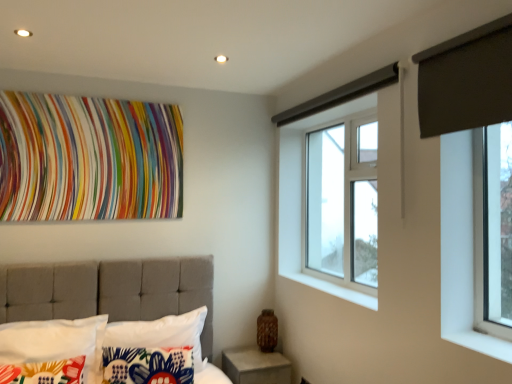
Question: Relative to clear glass window at upper center, is floral fabric pillow at lower left, which ranks as the 2th pillow in left-to-right order, in front or behind?

Choices:
 (A) front
 (B) behind

Answer: (A)

Question: Does point (146, 349) appear closer or farther from the camera than point (342, 198)?

Choices:
 (A) farther
 (B) closer

Answer: (B)

Question: Which of these objects is positioned closest to the white fabric pillow at lower left, arranged as the 3th pillow when viewed from the left?

Choices:
 (A) concrete at lower right
 (B) white concrete at lower center
 (C) white fabric pillow at lower left, positioned as the third pillow in right-to-left order
 (D) floral fabric pillow at lower left, the 2th pillow in the right-to-left sequence
 (E) dark gray fabric at upper right

Answer: (D)

Question: Which of these objects is positioned farthest from the white fabric pillow at lower left, arranged as the 1th pillow when viewed from the left?

Choices:
 (A) white concrete at lower center
 (B) multicolored fabric at upper center
 (C) dark gray fabric at upper right
 (D) white fabric pillow at lower left, arranged as the 3th pillow when viewed from the left
 (E) floral fabric pillow at lower left, the 2th pillow in the right-to-left sequence

Answer: (C)